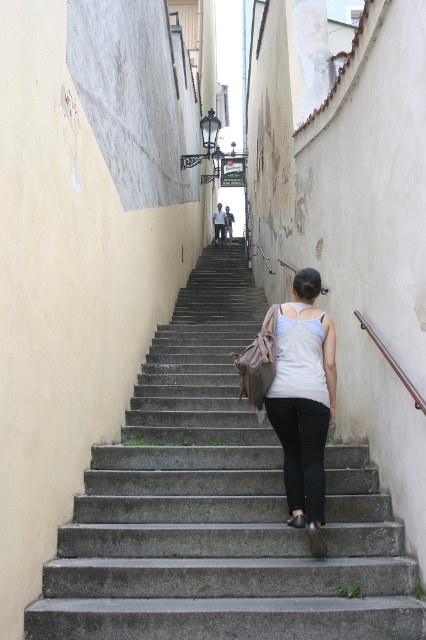
Does gray concrete stairs at center have a greater width compared to white matte tank top at center?

Yes, gray concrete stairs at center is wider than white matte tank top at center.

I want to click on gray concrete stairs at center, so click(218, 508).